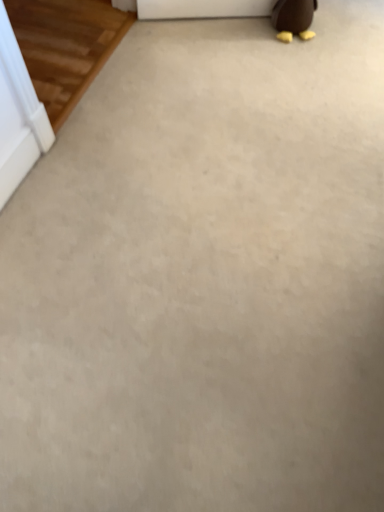
Where is `free location in front of brown matte penguin at upper right`? free location in front of brown matte penguin at upper right is located at coordinates (296, 60).